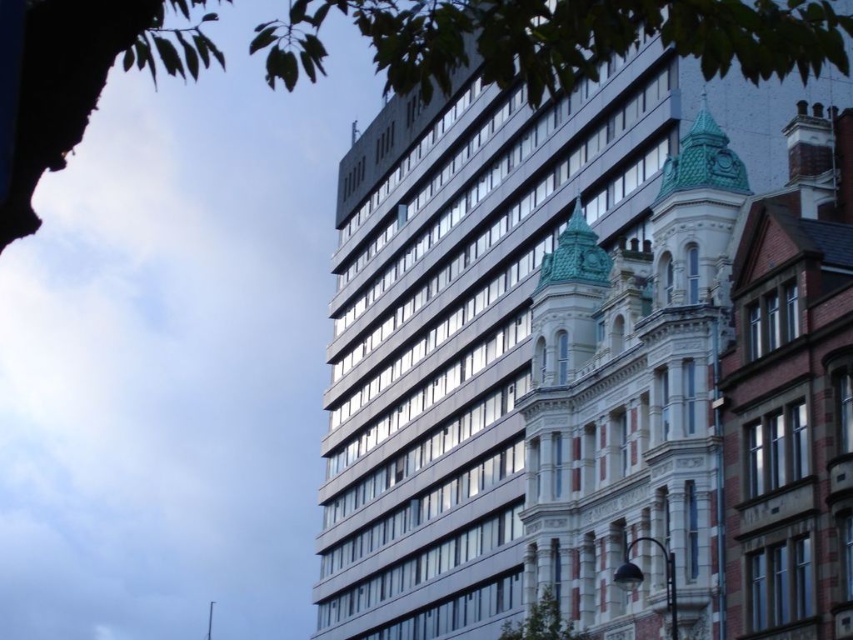
You are a drone operator who needs to fly a drone between the metallic glass building at upper center and the white stone building at center. The drone has a maximum flight distance of 15 meters. Can the drone safely fly between them without exceeding its range?

The distance between the metallic glass building at upper center and the white stone building at center is 14.11 meters, which is within the drone operator s 15 meter limit. Therefore, the drone can safely fly between them without exceeding its range.

You are a photographer standing in front of the modern high rise building on the left and the historic structure on the right. You want to take a photo that includes both buildings. There are two points marked in the image at point [541,579] and point [587,586]. Which point should you focus on to ensure both buildings are in focus?

You should focus on point [541,579] because it is closer to the camera than point [587,586]. Focusing on the closer point will help ensure both buildings remain in focus as they are at different distances.

You are an architect analyzing the skyline of this city. You notice the metallic glass building at upper center and the white stone building at center. Which one has a greater height?

The metallic glass building at upper center has a greater height compared to the white stone building at center.